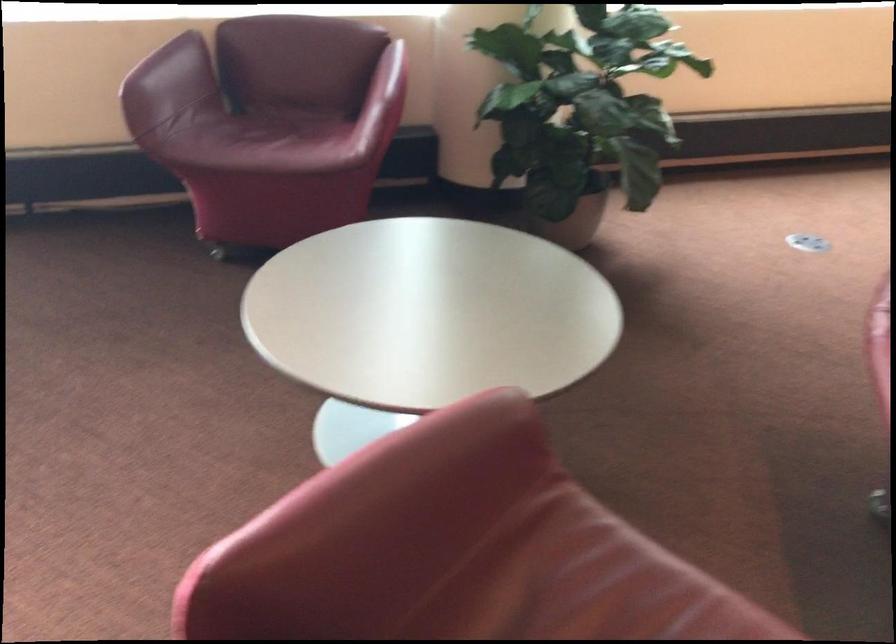
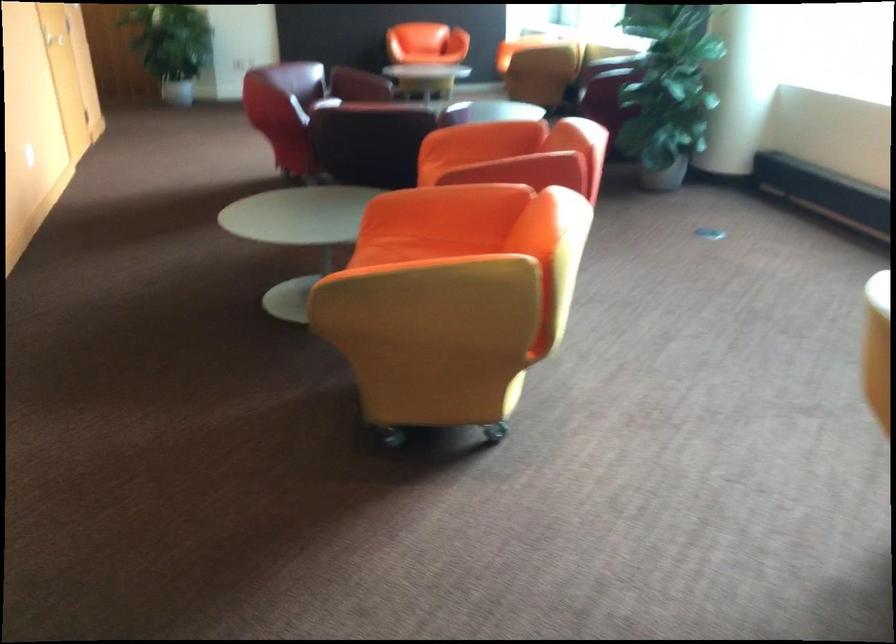
Where in the second image is the point corresponding to point 573,223 from the first image?

(643, 158)